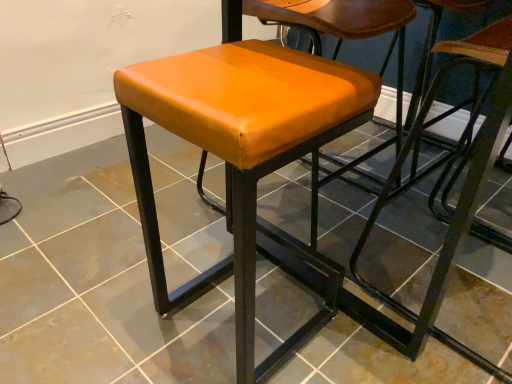
At what (x,y) coordinates should I click in order to perform the action: click on orange leather stool at center. Please return your answer as a coordinate pair (x, y). Looking at the image, I should click on (252, 140).

Describe the element at coordinates (252, 140) in the screenshot. This screenshot has width=512, height=384. I see `orange leather stool at center` at that location.

Measure the distance between point [311,121] and camera.

The distance of point [311,121] from camera is 26.02 inches.

Find the location of a particular element. The image size is (512, 384). orange leather stool at center is located at coordinates (252, 140).